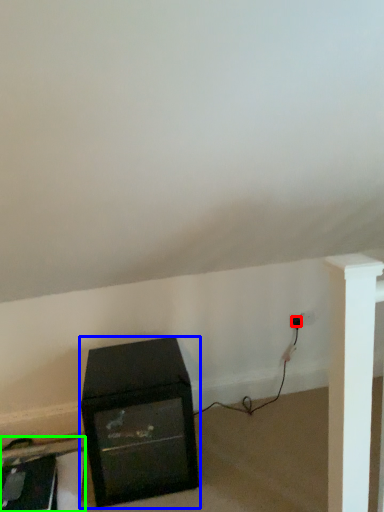
Question: Based on their relative distances, which object is nearer to plug (highlighted by a red box)? Choose from furniture (highlighted by a blue box) and furniture (highlighted by a green box).

Choices:
 (A) furniture
 (B) furniture

Answer: (A)